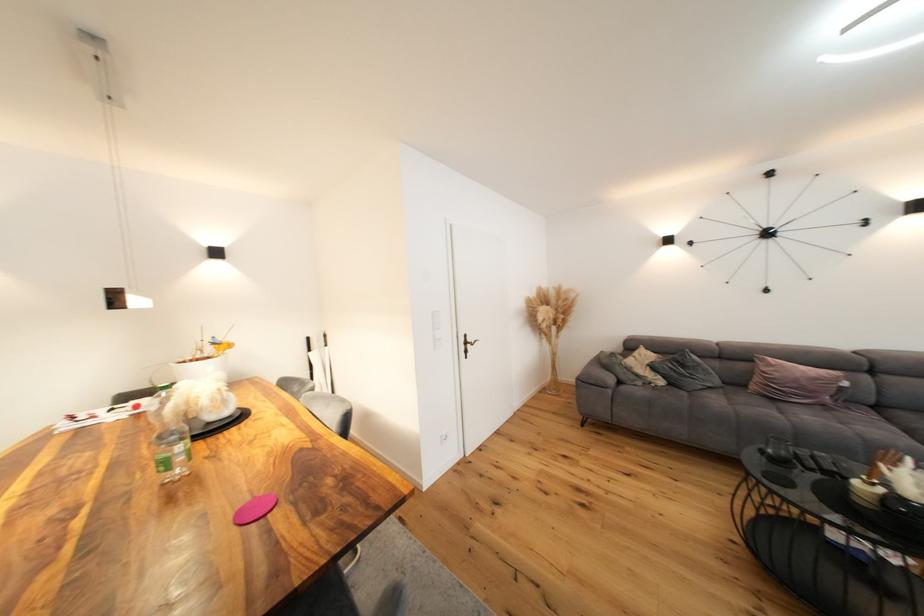
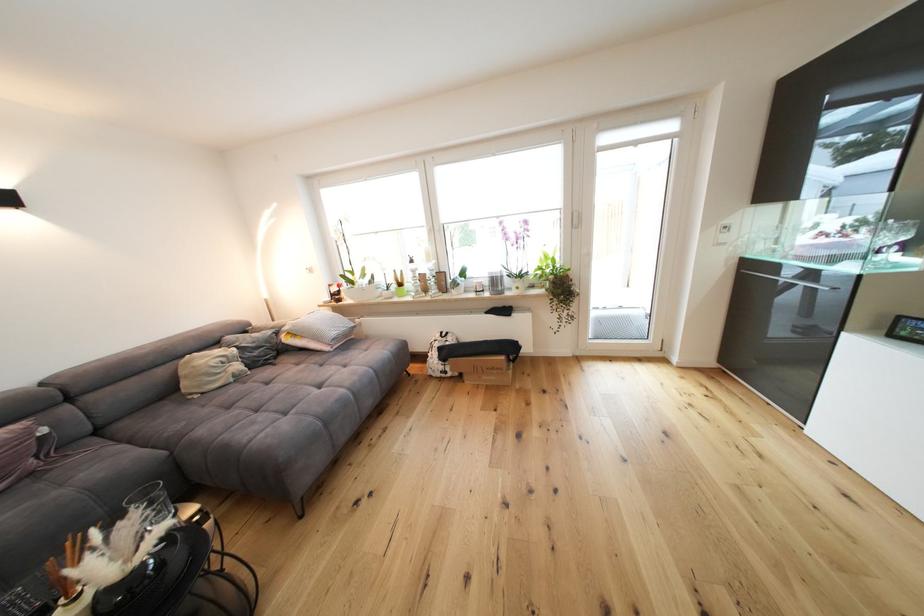
How did the camera likely rotate?

The camera's rotation is toward right-down.